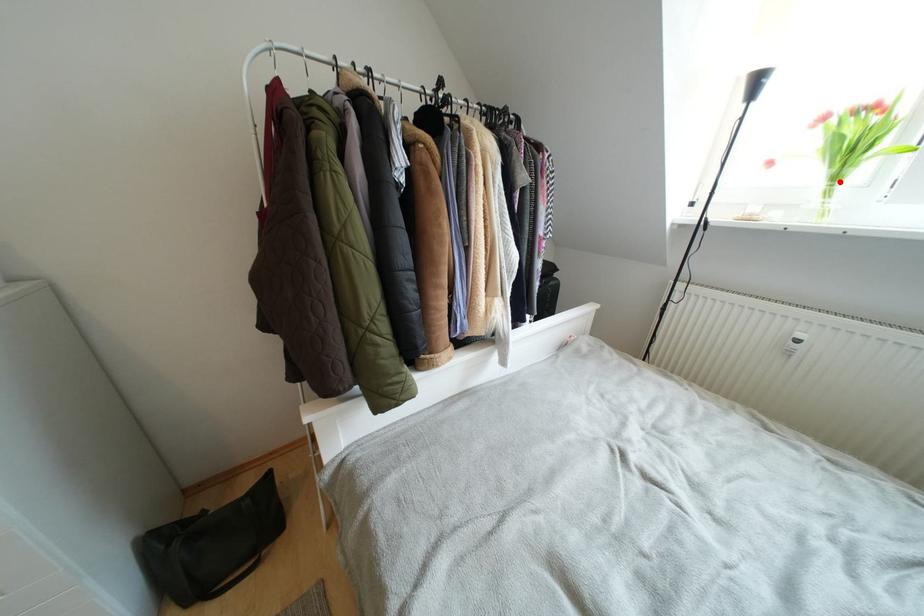
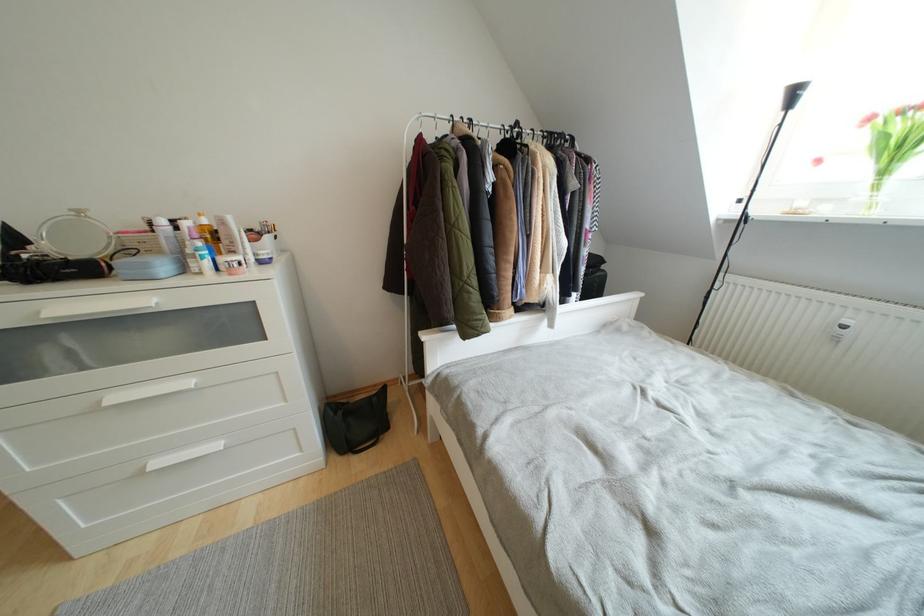
Question: I am providing you with two images of the same scene from different viewpoints. A red point is shown in image1. For the corresponding object point in image2, is it positioned nearer or farther from the camera?

Choices:
 (A) Nearer
 (B) Farther

Answer: (B)